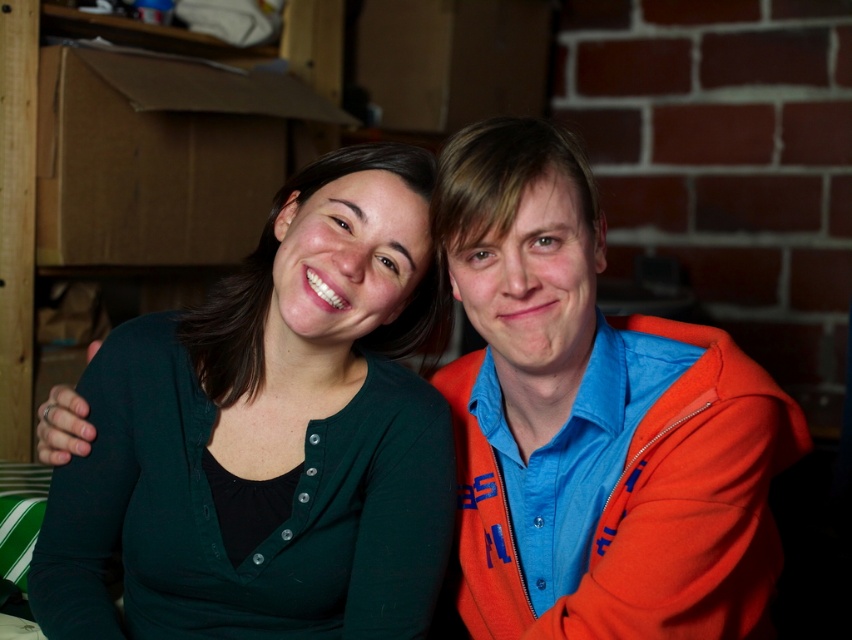
Question: In this image, where is green matte cardigan at center located relative to orange fleece jacket at right?

Choices:
 (A) above
 (B) below

Answer: (A)

Question: Which point appears closest to the camera in this image?

Choices:
 (A) (510, 598)
 (B) (216, 540)

Answer: (B)

Question: Which object appears farthest from the camera in this image?

Choices:
 (A) orange fleece jacket at right
 (B) green matte cardigan at center

Answer: (B)

Question: Is green matte cardigan at center positioned at the back of orange fleece jacket at right?

Choices:
 (A) no
 (B) yes

Answer: (B)

Question: Is green matte cardigan at center above orange fleece jacket at right?

Choices:
 (A) yes
 (B) no

Answer: (A)

Question: Which of the following is the closest to the observer?

Choices:
 (A) orange fleece jacket at right
 (B) green matte cardigan at center

Answer: (A)